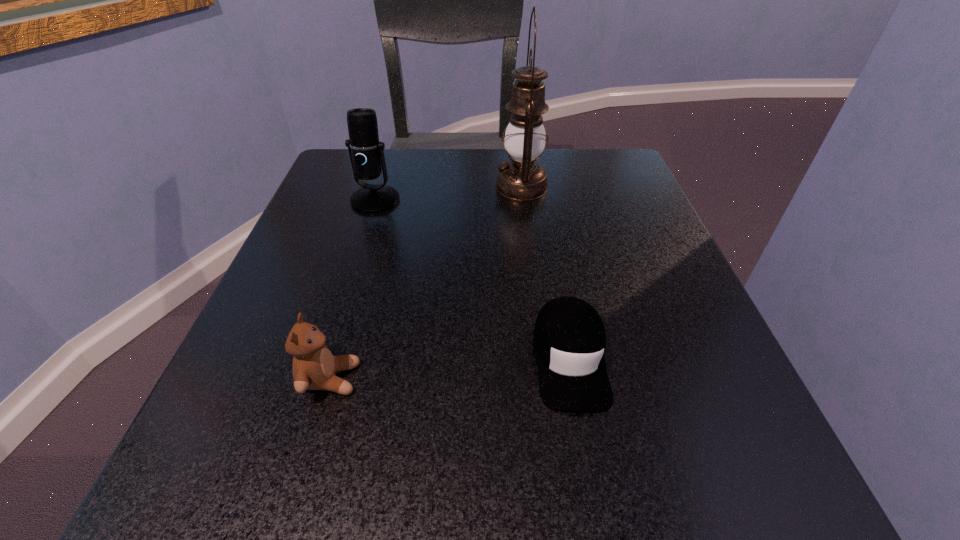
The height and width of the screenshot is (540, 960). I want to click on oil lamp, so click(x=522, y=178).

The image size is (960, 540). I want to click on the second tallest object, so click(366, 153).

Where is `teddy bear`? teddy bear is located at coordinates (314, 367).

Find the location of a particular element. cap is located at coordinates (569, 340).

Find the location of `vacant space located 0.180m on the front of the tallest object`. vacant space located 0.180m on the front of the tallest object is located at coordinates (532, 263).

This screenshot has height=540, width=960. I want to click on free region located 0.130m on the back of the microphone, so click(389, 158).

At what (x,y) coordinates should I click in order to perform the action: click on free region located on the front-facing side of the teddy bear. Please return your answer as a coordinate pair (x, y). The height and width of the screenshot is (540, 960). Looking at the image, I should click on (542, 379).

Where is `free space located on the front-facing side of the cap`? This screenshot has width=960, height=540. free space located on the front-facing side of the cap is located at coordinates (597, 516).

I want to click on oil lamp present at the far edge, so click(x=522, y=178).

Locate an element on the screen. This screenshot has height=540, width=960. microphone located at the far edge is located at coordinates (366, 153).